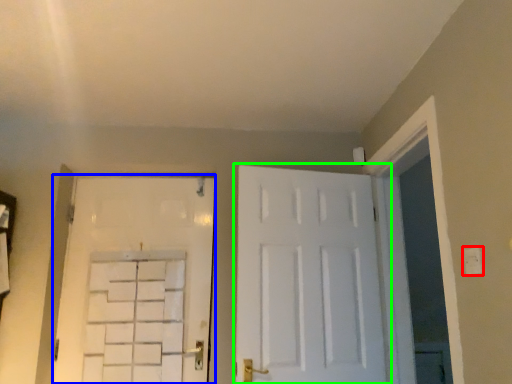
Question: Which object is positioned closest to electric outlet (highlighted by a red box)? Select from door (highlighted by a blue box) and door (highlighted by a green box).

Choices:
 (A) door
 (B) door

Answer: (B)